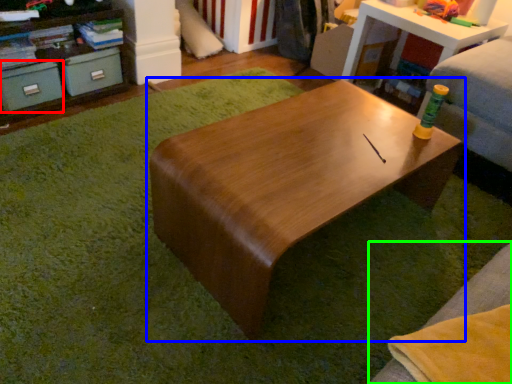
Question: Which is farther away from drawer (highlighted by a red box)? table (highlighted by a blue box) or couch (highlighted by a green box)?

Choices:
 (A) table
 (B) couch

Answer: (B)